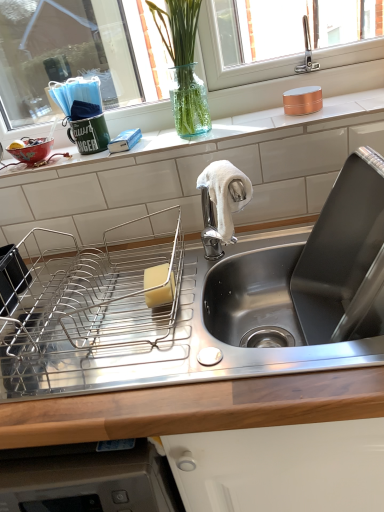
The height and width of the screenshot is (512, 384). Find the location of `free area behind yellow sponge at sink`. free area behind yellow sponge at sink is located at coordinates (169, 250).